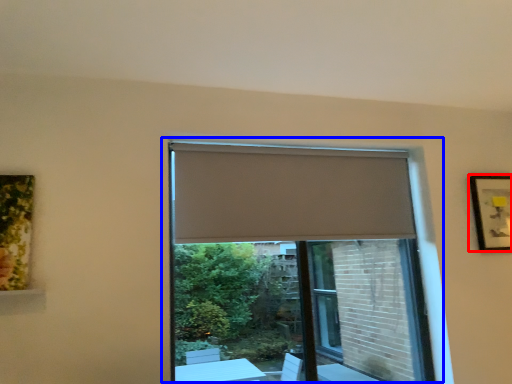
Question: Among these objects, which one is nearest to the camera, picture frame (highlighted by a red box) or window (highlighted by a blue box)?

Choices:
 (A) picture frame
 (B) window

Answer: (B)